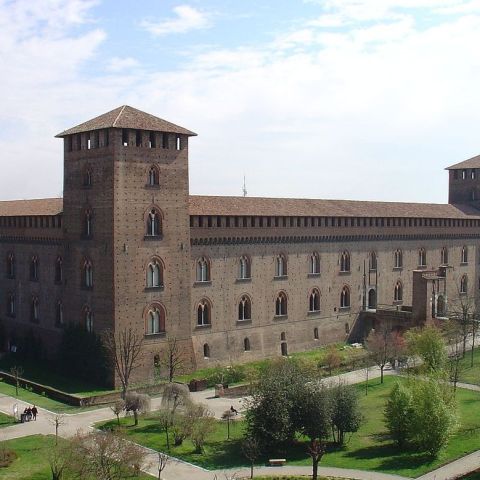
Where is `dark window of cathedral window`? The width and height of the screenshot is (480, 480). dark window of cathedral window is located at coordinates (201, 311), (242, 308), (279, 301), (317, 299), (344, 296), (158, 221).